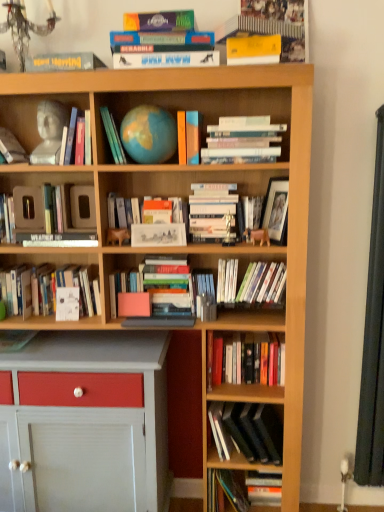
Question: Considering their positions, is clear plastic book at center, positioned as the fourth book in bottom-to-top order, located in front of or behind white matte book at center, which is the fifth book from bottom to top?

Choices:
 (A) behind
 (B) front

Answer: (B)

Question: Considering the positions of point (208, 318) and point (57, 269), is point (208, 318) closer or farther from the camera than point (57, 269)?

Choices:
 (A) closer
 (B) farther

Answer: (A)

Question: Estimate the real-world distances between objects in this image. Which object is farther from the clear plastic book at center, positioned as the fourth book in bottom-to-top order?

Choices:
 (A) yellow paper at upper center, acting as the first book starting from the top
 (B) hardcover book at center, which is the 12th book in bottom-to-top order
 (C) white paper at center, the 9th book viewed from the top
 (D) white matte book at center, which is the twelfth book in top-to-bottom order
 (E) matte blue globe at center, which ranks as the 3th book in top-to-bottom order

Answer: (A)

Question: Based on their relative distances, which object is nearer to the hardcover book at center, the 8th book in the top-to-bottom sequence?

Choices:
 (A) hardcover books at center, which is the fourteenth book in top-to-bottom order
 (B) hardcover book at lower right, placed as the first book when sorted from bottom to top
 (C) matte black book at upper left, which appears as the fifteenth book when ordered from the bottom
 (D) white paperbacks at upper center, the sixth book viewed from the top
 (E) yellow paper at upper center

Answer: (D)